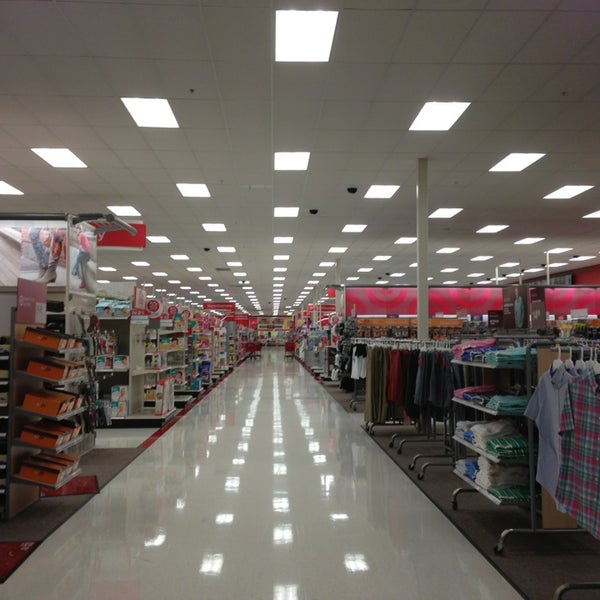
Identify the location of ceiling lights. The image size is (600, 600). (286, 215), (191, 188), (225, 247), (447, 212).